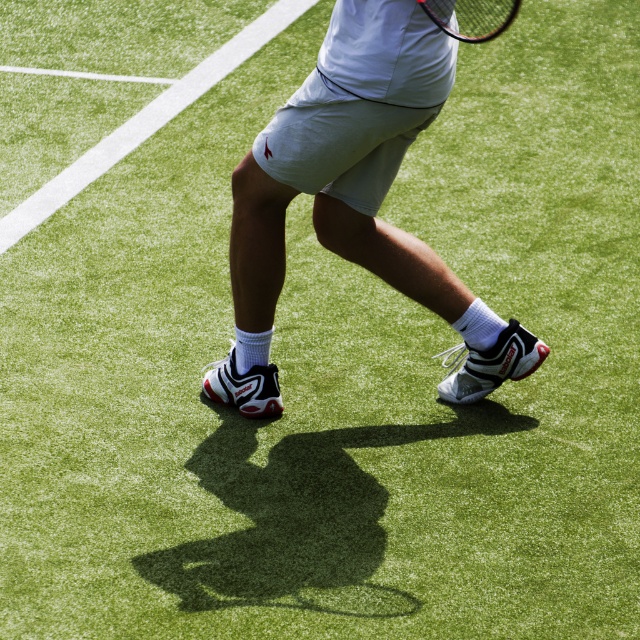
In the scene shown: You are a photographer trying to capture the tennis player in a way that the white mesh shorts at center and the black matte tennis racket at upper center are both clearly visible. Based on their positions, which object should you focus on first to ensure both are in frame?

The white mesh shorts at center should be focused on first since it is positioned on the left side of the black matte tennis racket at upper center, ensuring both are within the frame by starting from the left.

You are a tennis player standing at point A, which is at the bottom left corner of the court. You want to move to the ball located at point B, which is at the top right corner of the court. However, there is an obstacle at point C, which is at point (353,198). What object is located at point C?

The object located at point C is white mesh shorts at center.